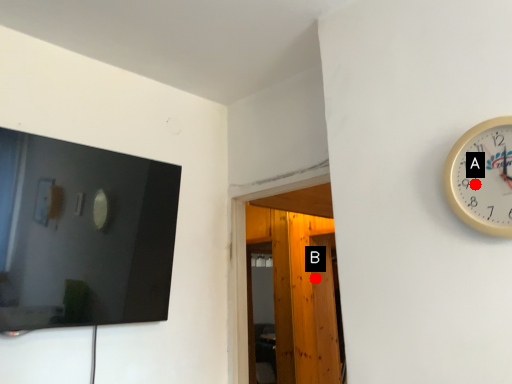
Question: Two points are circled on the image, labeled by A and B beside each circle. Which of the following is the closest to the observer?

Choices:
 (A) A is closer
 (B) B is closer

Answer: (A)